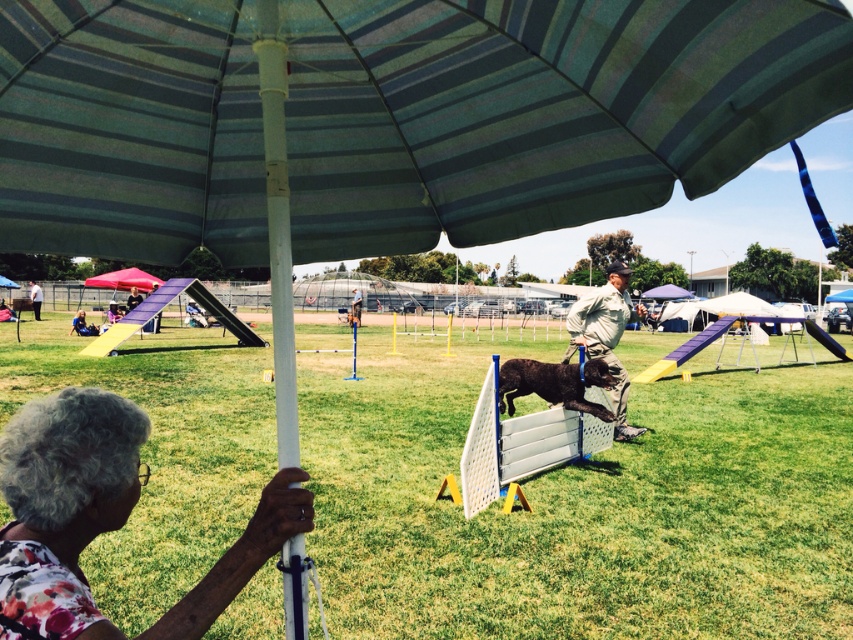
Question: Is green striped umbrella at upper center bigger than white fabric umbrella at upper center?

Choices:
 (A) no
 (B) yes

Answer: (A)

Question: Does green striped umbrella at upper center have a smaller size compared to white plastic hurdle at center?

Choices:
 (A) no
 (B) yes

Answer: (B)

Question: Based on their relative distances, which object is farther from the khaki uniform at center?

Choices:
 (A) shiny brown dog at center
 (B) white plastic hurdle at center

Answer: (B)

Question: Which point appears farthest from the camera in this image?

Choices:
 (A) (38, 525)
 (B) (39, 296)
 (C) (506, 401)

Answer: (B)

Question: Estimate the real-world distances between objects in this image. Which object is closer to the white fabric umbrella at upper center?

Choices:
 (A) shiny brown dog at center
 (B) red fabric canopy at upper left
 (C) white plastic hurdle at center

Answer: (B)

Question: Does green striped umbrella at upper center appear on the left side of shiny brown dog at center?

Choices:
 (A) yes
 (B) no

Answer: (A)